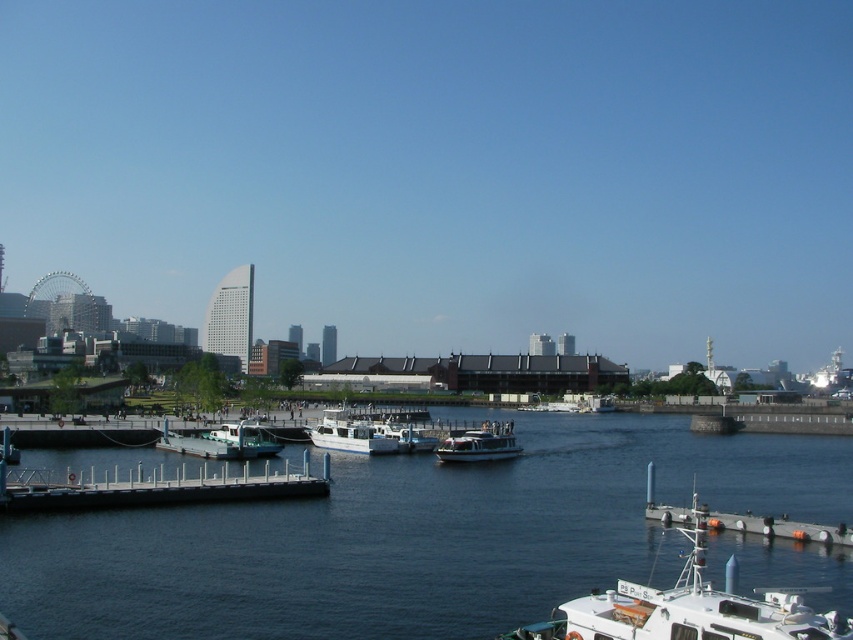
Question: Which object is positioned closest to the metallic silver boat at center-left?

Choices:
 (A) white glossy boat at center
 (B) white matte boat at center
 (C) white matte boat at lower right

Answer: (B)

Question: Is white wooden dock at lower left wider than white matte boat at center?

Choices:
 (A) no
 (B) yes

Answer: (B)

Question: Does white matte boat at lower right appear on the left side of white glossy boat at center?

Choices:
 (A) no
 (B) yes

Answer: (A)

Question: From the image, what is the correct spatial relationship of blue water at center in relation to white matte boat at center?

Choices:
 (A) above
 (B) below

Answer: (B)

Question: Which point is farther to the camera?

Choices:
 (A) white matte boat at center
 (B) blue water at center
 (C) white glossy boat at center

Answer: (A)

Question: Which object is closer to the camera taking this photo?

Choices:
 (A) white matte boat at center
 (B) blue water at center
 (C) white matte boat at lower right
 (D) white glossy boat at center

Answer: (C)